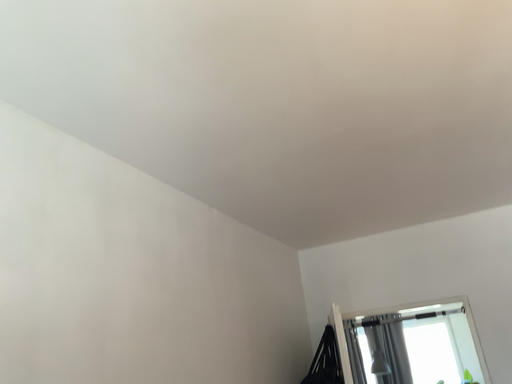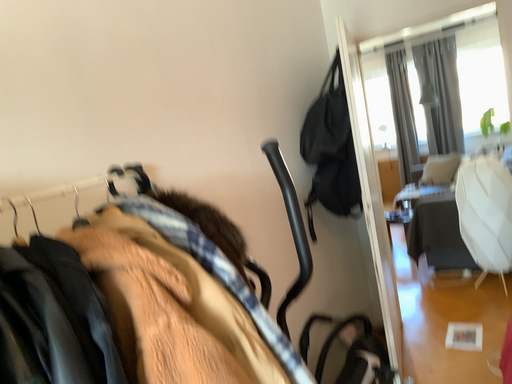
Question: Which way did the camera rotate in the video?

Choices:
 (A) rotated upward
 (B) rotated downward

Answer: (B)